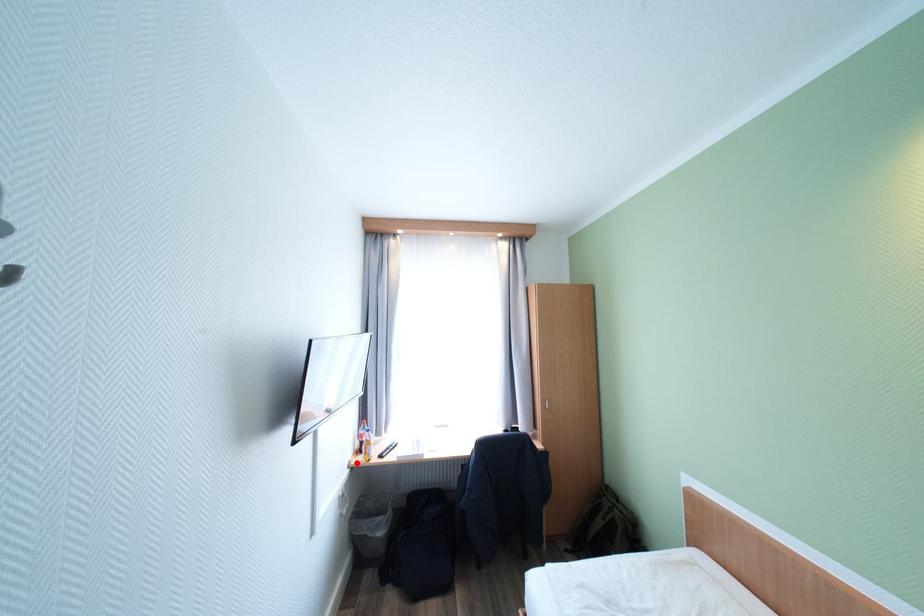
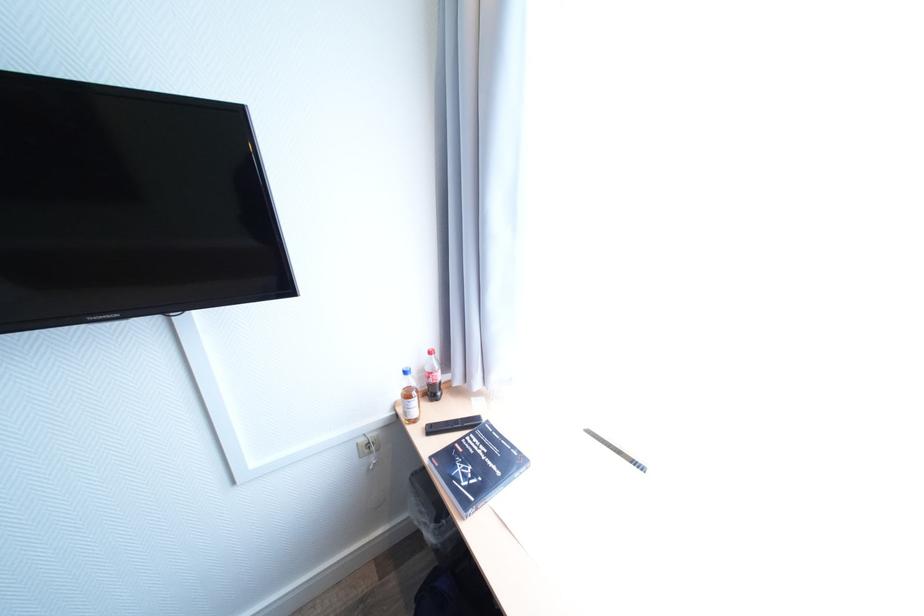
Find the pixel in the second image that matches the highlighted location in the first image.

(403, 403)